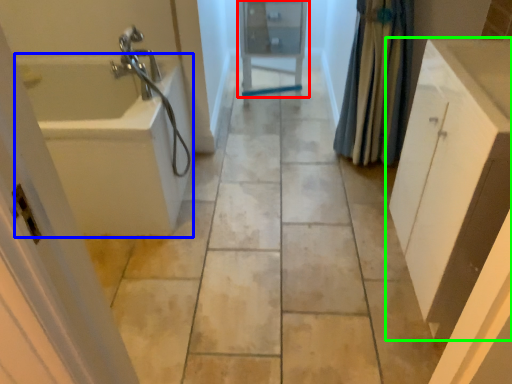
Question: Which object is the farthest from medicine cabinet (highlighted by a red box)? Choose among these: bath (highlighted by a blue box) or bathroom cabinet (highlighted by a green box).

Choices:
 (A) bath
 (B) bathroom cabinet

Answer: (B)